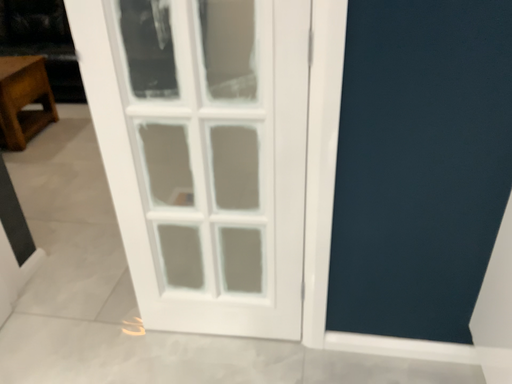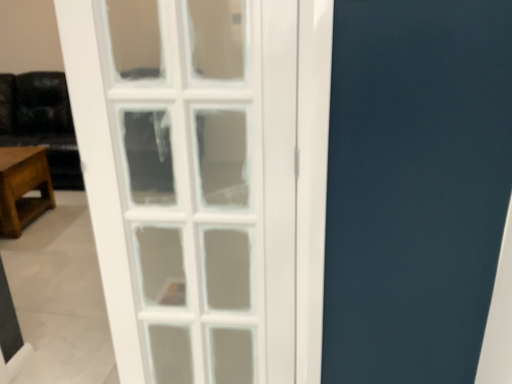
Question: Which way did the camera rotate in the video?

Choices:
 (A) rotated downward
 (B) rotated upward

Answer: (B)